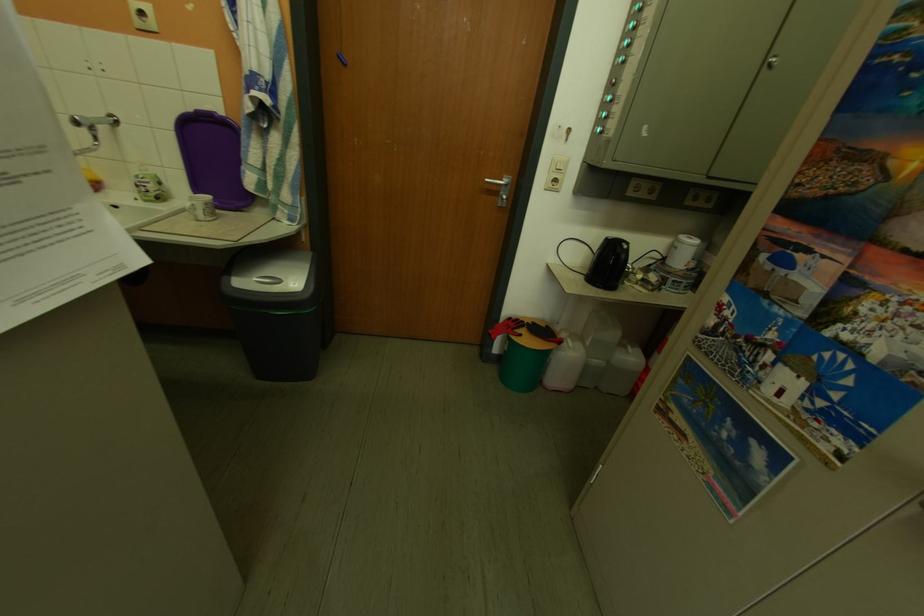
This screenshot has height=616, width=924. What do you see at coordinates (555, 172) in the screenshot?
I see `the white light switch` at bounding box center [555, 172].